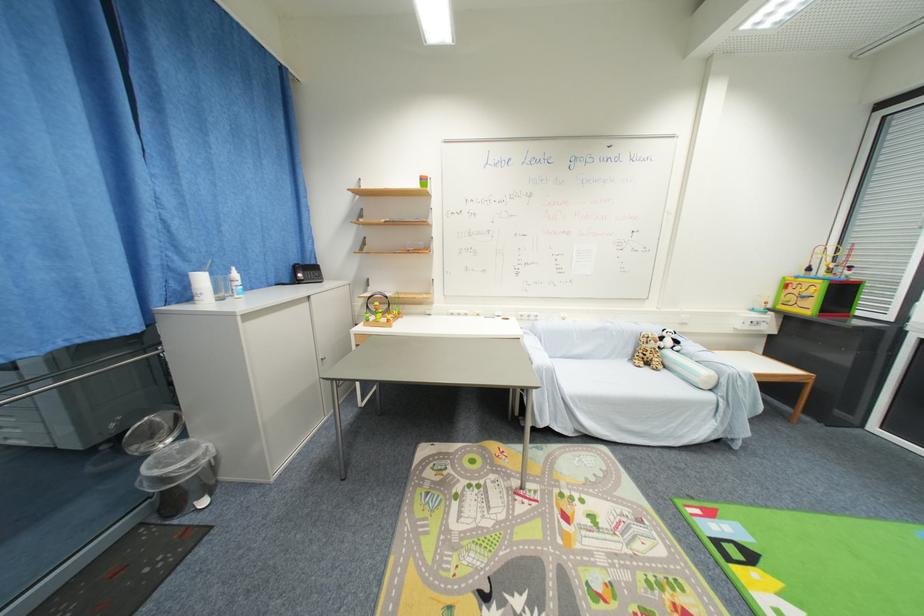
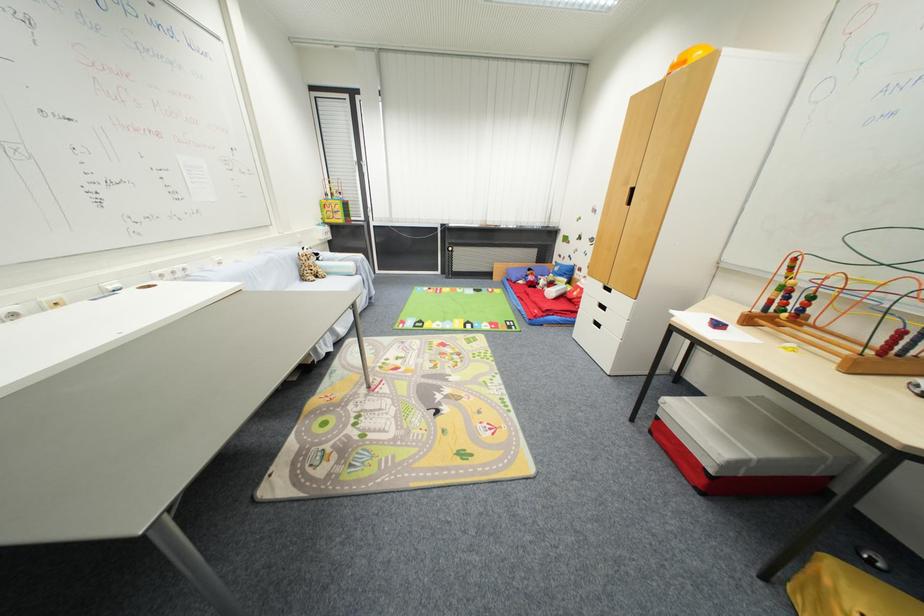
Where in the second image is the point corresponding to [666,554] from the first image?

(423, 342)